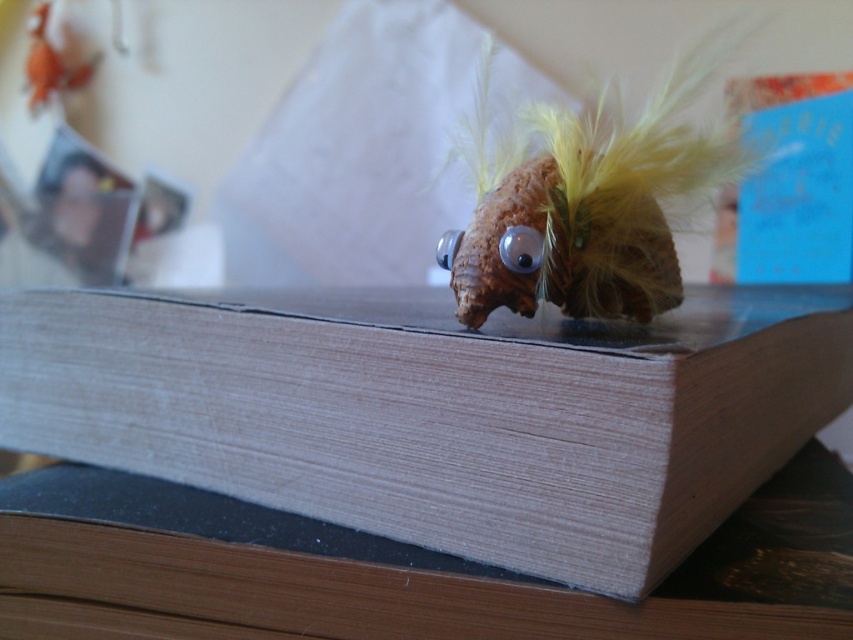
Can you confirm if wooden paperback book at center is positioned to the left of fuzzy brown snail at center?

Correct, you'll find wooden paperback book at center to the left of fuzzy brown snail at center.

Does wooden paperback book at center have a greater width compared to fuzzy brown snail at center?

Indeed, wooden paperback book at center has a greater width compared to fuzzy brown snail at center.

Is point (753, 452) closer to camera compared to point (480, 268)?

That is False.

Locate an element on the screen. wooden paperback book at center is located at coordinates (440, 412).

Which is more to the left, fuzzy brown snail at center or orange plush toy at upper left?

Positioned to the left is orange plush toy at upper left.

Does point (492, 300) come in front of point (41, 104)?

Yes, point (492, 300) is in front of point (41, 104).

This screenshot has width=853, height=640. What do you see at coordinates (583, 202) in the screenshot? I see `fuzzy brown snail at center` at bounding box center [583, 202].

You are a GUI agent. You are given a task and a screenshot of the screen. Output one action in this format:
    pyautogui.click(x=<x>, y=<y>)
    Task: Click on the fuzzy brown snail at center
    The image size is (853, 640).
    Given the screenshot: What is the action you would take?
    pyautogui.click(x=583, y=202)

Can you confirm if wooden paperback book at center is thinner than orange plush toy at upper left?

No, wooden paperback book at center is not thinner than orange plush toy at upper left.

Is wooden paperback book at center below orange plush toy at upper left?

Indeed, wooden paperback book at center is positioned under orange plush toy at upper left.

Describe the element at coordinates (440, 412) in the screenshot. I see `wooden paperback book at center` at that location.

What are the coordinates of `wooden paperback book at center` in the screenshot? It's located at (440, 412).